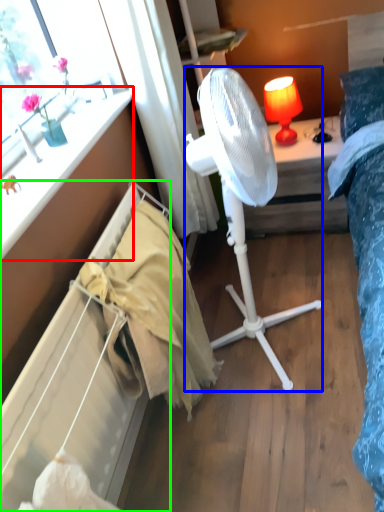
Question: Considering the real-world distances, which object is farthest from window sill (highlighted by a red box)? mechanical fan (highlighted by a blue box) or radiator (highlighted by a green box)?

Choices:
 (A) mechanical fan
 (B) radiator

Answer: (A)